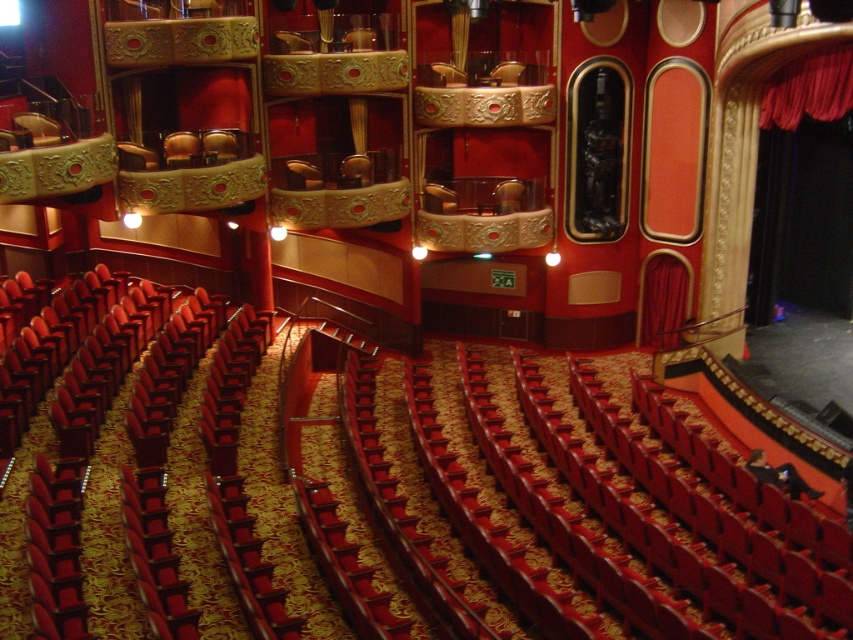
Which is behind, point (831, 74) or point (189, 161)?

The point (189, 161) is more distant.

Where is `red velvet curtain at upper right`? The width and height of the screenshot is (853, 640). red velvet curtain at upper right is located at coordinates (809, 88).

Identify the location of red velvet curtain at upper right. This screenshot has width=853, height=640. (809, 88).